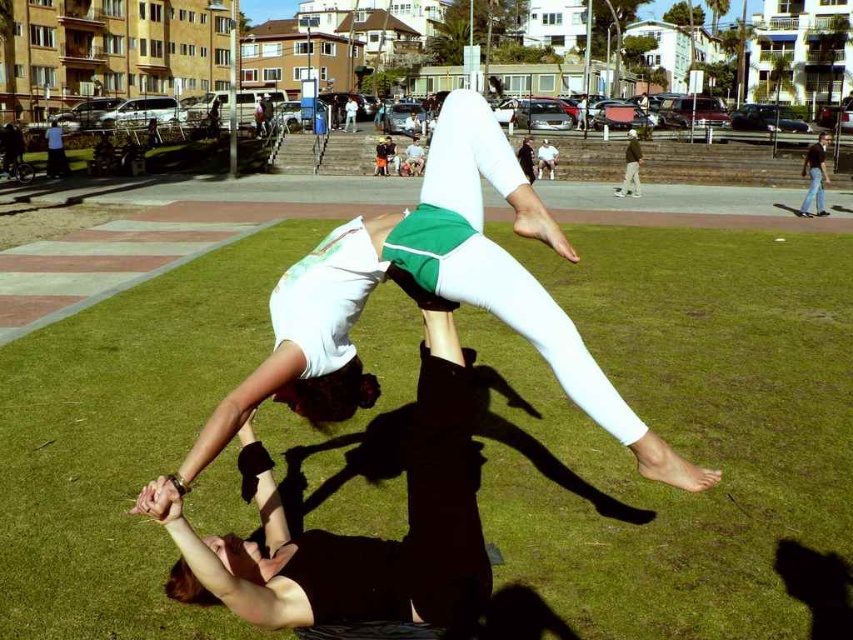
You are a photographer trying to capture the acrobatic performance. To ensure the green grass at center is in focus, where should you position your camera relative to the scene?

The green grass at center is located at coordinates point (x=676, y=442), so you should position your camera to focus on that specific point to ensure the green grass at center is in focus.